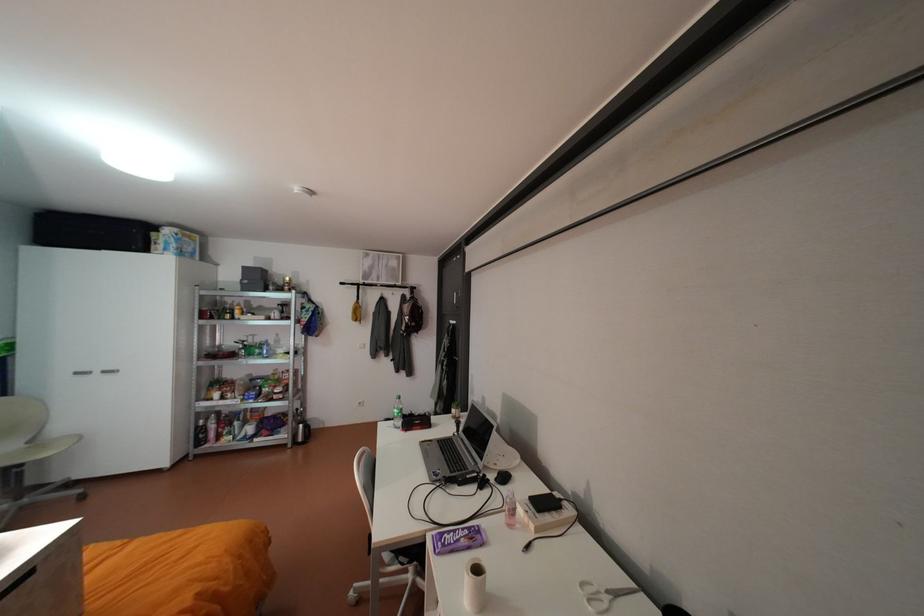
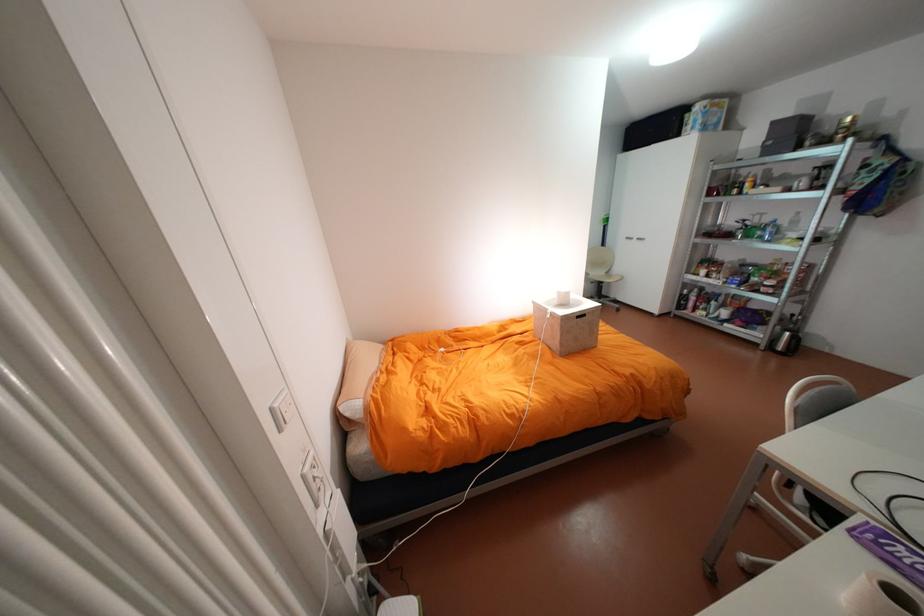
The point at (27, 580) is marked in the first image. Where is the corresponding point in the second image?

(590, 315)